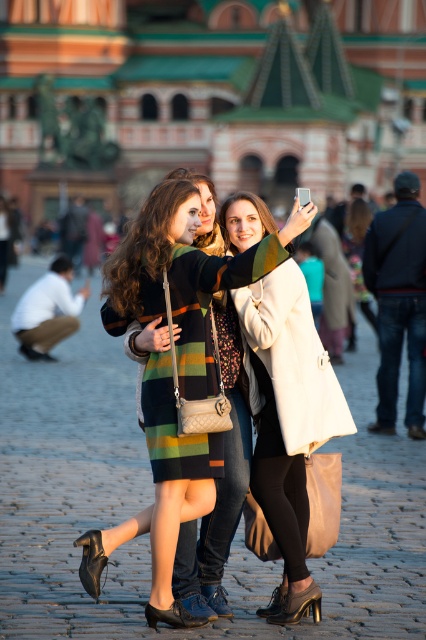
In the scene shown: You are a photographer standing in the public square and want to take a photo of the striped wool dress at center and the white leather coat at center. If your camera has a maximum focus range of 3 meters, can you capture both items clearly in the same frame without moving?

The striped wool dress at center is 3.56 meters away from the white leather coat at center. Since the distance between them exceeds the camera maximum focus range of 3 meters, you cannot capture both items clearly in the same frame without moving.

You are a photographer trying to capture a group photo of the striped wool dress at center and dark blue jeans at right. Given that your camera has a maximum focus range of 20 meters, will you be able to capture both subjects clearly in the same frame?

The striped wool dress at center and dark blue jeans at right are 21.13 meters apart. Since the camera has a maximum focus range of 20 meters, it will not be able to capture both subjects clearly in the same frame.